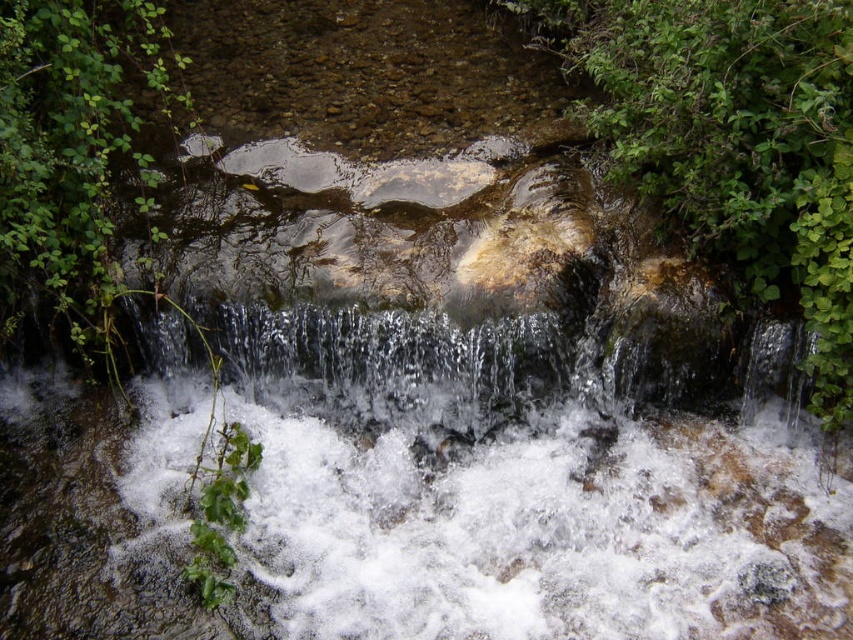
Question: Can you confirm if green leafy plant at center right is positioned to the left of clear water at center?

Choices:
 (A) yes
 (B) no

Answer: (B)

Question: Which point is farther to the camera?

Choices:
 (A) green leafy plant at center right
 (B) clear water at center

Answer: (B)

Question: From the image, what is the correct spatial relationship of green leafy plant at left in relation to clear water at center?

Choices:
 (A) below
 (B) above

Answer: (B)

Question: Is the position of green leafy plant at center right more distant than that of clear water at center?

Choices:
 (A) yes
 (B) no

Answer: (B)

Question: Among these points, which one is nearest to the camera?

Choices:
 (A) (32, 38)
 (B) (548, 358)

Answer: (A)

Question: Based on their relative distances, which object is nearer to the green leafy plant at left?

Choices:
 (A) green leafy plant at center right
 (B) clear water at center

Answer: (B)